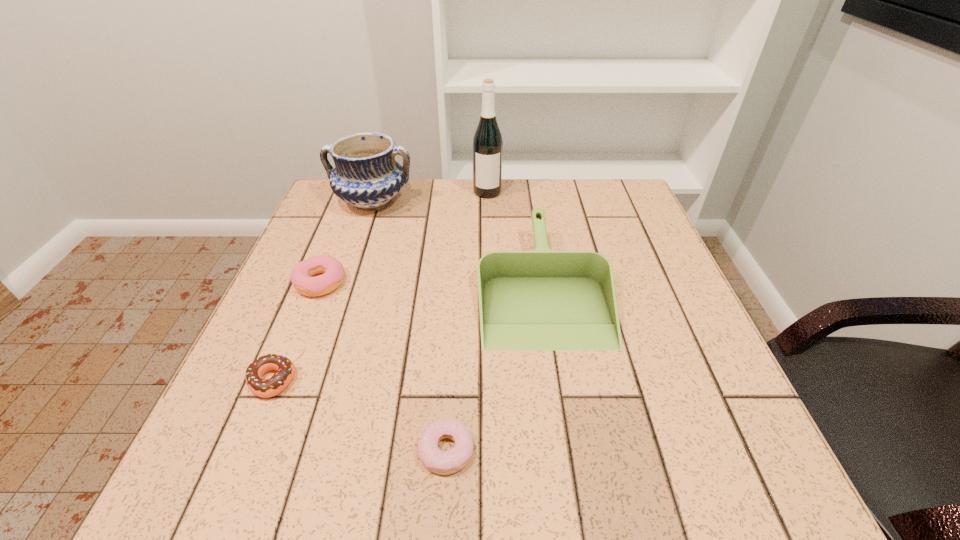
Where is `vacant area at the far edge`? This screenshot has height=540, width=960. vacant area at the far edge is located at coordinates (542, 207).

Where is `blank area at the near edge`? blank area at the near edge is located at coordinates (300, 467).

Image resolution: width=960 pixels, height=540 pixels. Find the location of `vacant area at the left edge`. vacant area at the left edge is located at coordinates (212, 416).

The image size is (960, 540). Identify the location of vacant position at the right edge of the desktop. (653, 233).

Find the location of a particular element. The height and width of the screenshot is (540, 960). vacant space at the far right corner of the desktop is located at coordinates (603, 220).

The width and height of the screenshot is (960, 540). Find the location of `vacant space that's between the dustpan and the fifth farthest object`. vacant space that's between the dustpan and the fifth farthest object is located at coordinates [x=407, y=333].

The width and height of the screenshot is (960, 540). I want to click on free point between the wine bottle and the fifth farthest object, so click(x=379, y=286).

The image size is (960, 540). I want to click on vacant area between the fifth shortest object and the nearest doughnut, so click(409, 326).

Locate an element on the screen. The image size is (960, 540). vacant area that lies between the shortest doughnut and the fourth shortest object is located at coordinates (494, 368).

Find the location of `free point between the wine bottle and the farthest doughnut`. free point between the wine bottle and the farthest doughnut is located at coordinates (404, 238).